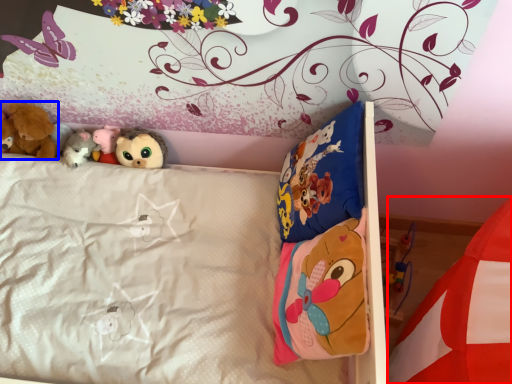
Question: Among these objects, which one is farthest to the camera, mattress (highlighted by a red box) or toy (highlighted by a blue box)?

Choices:
 (A) mattress
 (B) toy

Answer: (B)